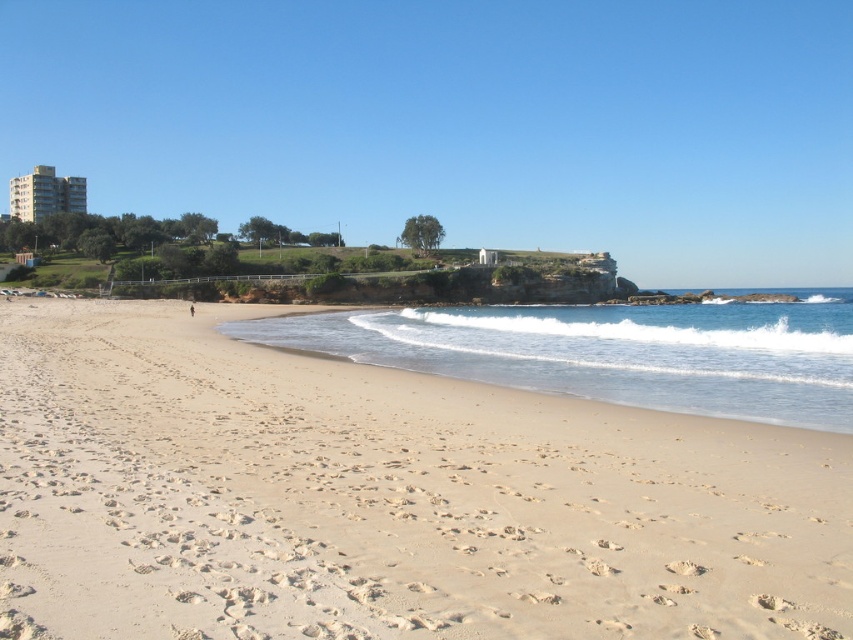
Does point (506, 612) lie behind point (376, 353)?

No, (506, 612) is in front of (376, 353).

Where is `light beige sand at lower center`? The width and height of the screenshot is (853, 640). light beige sand at lower center is located at coordinates (384, 499).

Identify the location of light beige sand at lower center. (384, 499).